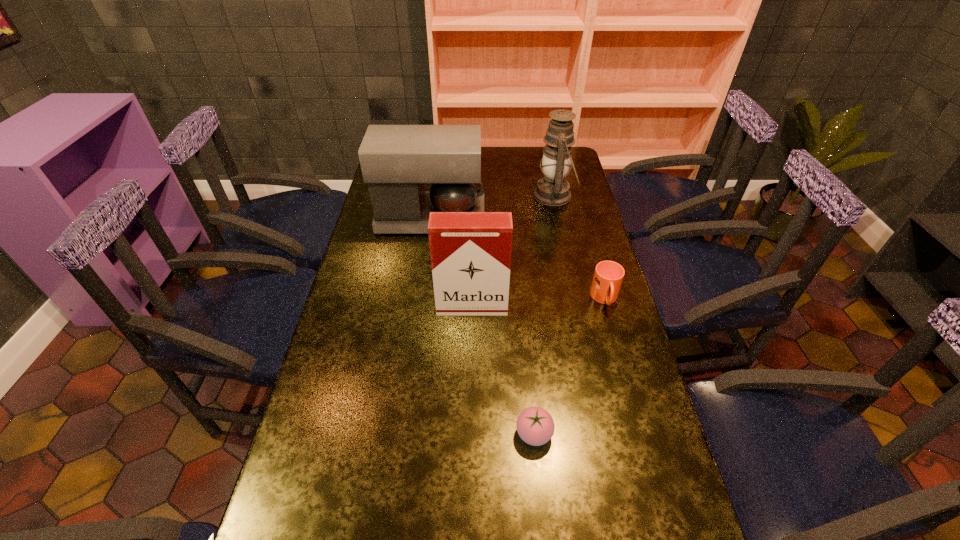
Identify the location of free location located 0.190m on the left of the nearest object. This screenshot has width=960, height=540. (434, 434).

The width and height of the screenshot is (960, 540). Find the location of `object that is at the left edge`. object that is at the left edge is located at coordinates click(x=397, y=161).

Find the location of a particular element. oil lamp situated at the right edge is located at coordinates (553, 190).

Find the location of `mug at the right edge`. mug at the right edge is located at coordinates (608, 276).

Locate an element on the screen. vacant space at the left edge is located at coordinates (395, 268).

In the image, there is a desktop. Find the location of `free region at the right edge`. free region at the right edge is located at coordinates (600, 315).

You are a GUI agent. You are given a task and a screenshot of the screen. Output one action in this format:
    pyautogui.click(x=<x>, y=<y>)
    Task: Click on the free spot between the fourth tallest object and the shortest object
    The width and height of the screenshot is (960, 540).
    Given the screenshot: What is the action you would take?
    pyautogui.click(x=569, y=366)

Where is `vacant region between the second shortest object and the cigarette_case`? vacant region between the second shortest object and the cigarette_case is located at coordinates (539, 303).

Image resolution: width=960 pixels, height=540 pixels. I want to click on vacant area that lies between the fourth tallest object and the oil lamp, so click(580, 247).

Where is `vacant region between the cigarette_case and the oil lamp`? Image resolution: width=960 pixels, height=540 pixels. vacant region between the cigarette_case and the oil lamp is located at coordinates (514, 251).